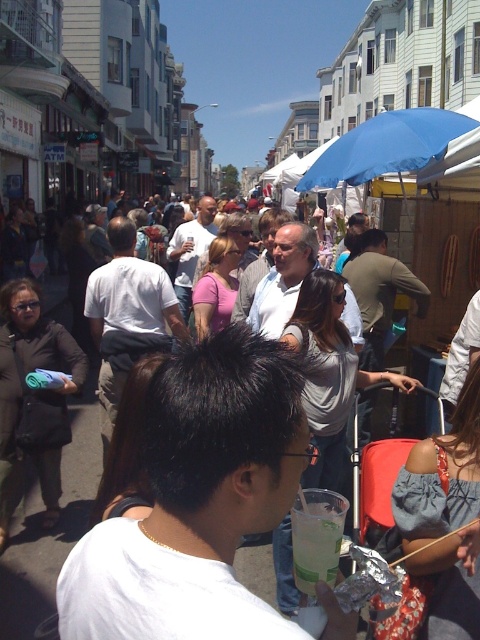
Between blue fabric umbrella at upper right and clear plastic cup at center, which one is positioned higher?

blue fabric umbrella at upper right is above.

Which is more to the right, blue fabric umbrella at upper right or clear plastic cup at center?

blue fabric umbrella at upper right

Measure the distance between point (443, 120) and camera.

They are 22.65 feet apart.

Find the location of `blue fabric umbrella at upper right`. blue fabric umbrella at upper right is located at coordinates (385, 147).

Is white plastic cup at center to the right of blue fabric umbrella at upper right from the viewer's perspective?

In fact, white plastic cup at center is to the left of blue fabric umbrella at upper right.

Is point (172, 461) positioned in front of point (365, 164)?

That is True.

Locate an element on the screen. white plastic cup at center is located at coordinates click(197, 500).

Is white cotton shirt at center positioned in front of clear plastic cup at center?

That is False.

Who is positioned more to the left, white cotton shirt at center or clear plastic cup at center?

Positioned to the left is white cotton shirt at center.

Identify the location of white cotton shirt at center. (50, 531).

Locate an element on the screen. white cotton shirt at center is located at coordinates (50, 531).